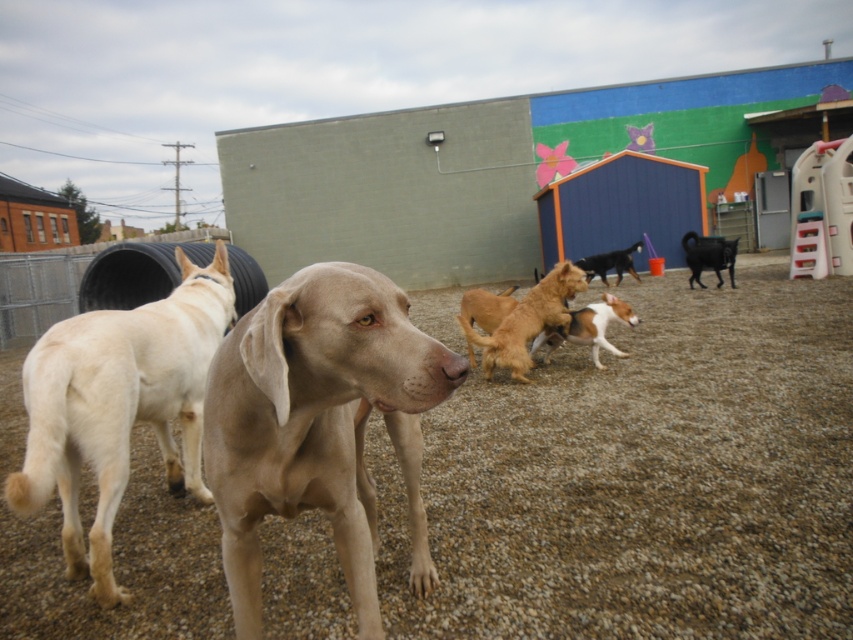
Does smooth tan dog at center have a lesser width compared to black glossy goat at center right?

Yes.

Does smooth tan dog at center appear on the right side of black glossy goat at center right?

In fact, smooth tan dog at center is to the left of black glossy goat at center right.

Who is more distant from viewer, (361, 470) or (689, 234)?

Positioned behind is point (689, 234).

Identify the location of smooth tan dog at center. (318, 424).

Who is positioned more to the right, brown gravel at center or black glossy dog at center?

black glossy dog at center

Is point (732, 520) farther from camera compared to point (619, 266)?

No, it is not.

Does point (820, 348) come farther from viewer compared to point (583, 259)?

No, (820, 348) is closer to viewer.

Locate an element on the screen. The width and height of the screenshot is (853, 640). brown gravel at center is located at coordinates [x=643, y=477].

Is black glossy goat at center right to the left of black glossy dog at center from the viewer's perspective?

In fact, black glossy goat at center right is to the right of black glossy dog at center.

Does black glossy goat at center right have a lesser width compared to black glossy dog at center?

Correct, black glossy goat at center right's width is less than black glossy dog at center's.

Identify the location of black glossy goat at center right. click(708, 257).

Identify the location of black glossy goat at center right. This screenshot has height=640, width=853. (708, 257).